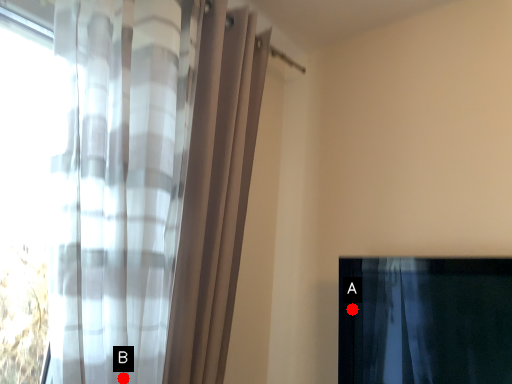
Question: Two points are circled on the image, labeled by A and B beside each circle. Which point is farther to the camera?

Choices:
 (A) A is further
 (B) B is further

Answer: (A)